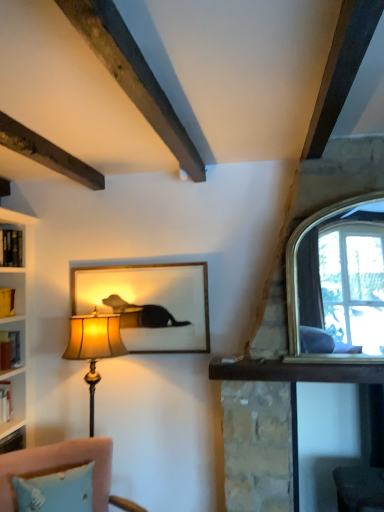
Question: Is velvet pink sofa at lower left not inside clear glass window at upper right?

Choices:
 (A) no
 (B) yes

Answer: (B)

Question: Is velvet pink sofa at lower left shorter than clear glass window at upper right?

Choices:
 (A) yes
 (B) no

Answer: (A)

Question: Is velvet pink sofa at lower left facing away from clear glass window at upper right?

Choices:
 (A) no
 (B) yes

Answer: (A)

Question: Is the surface of velvet pink sofa at lower left in direct contact with clear glass window at upper right?

Choices:
 (A) no
 (B) yes

Answer: (A)

Question: From the image's perspective, is velvet pink sofa at lower left below clear glass window at upper right?

Choices:
 (A) no
 (B) yes

Answer: (B)

Question: From a real-world perspective, is velvet pink sofa at lower left on clear glass window at upper right?

Choices:
 (A) no
 (B) yes

Answer: (A)

Question: From the image's perspective, would you say matte glass picture frame at center is positioned over matte gold lampshade at left?

Choices:
 (A) no
 (B) yes

Answer: (B)

Question: Does matte glass picture frame at center turn towards matte gold lampshade at left?

Choices:
 (A) yes
 (B) no

Answer: (A)

Question: Are matte glass picture frame at center and matte gold lampshade at left located far from each other?

Choices:
 (A) no
 (B) yes

Answer: (A)

Question: Can you confirm if matte glass picture frame at center is positioned to the right of matte gold lampshade at left?

Choices:
 (A) yes
 (B) no

Answer: (A)

Question: Can you confirm if matte glass picture frame at center is wider than matte gold lampshade at left?

Choices:
 (A) no
 (B) yes

Answer: (A)

Question: From the image's perspective, is matte glass picture frame at center beneath matte gold lampshade at left?

Choices:
 (A) yes
 (B) no

Answer: (B)

Question: Does matte gold lampshade at left have a greater height compared to matte glass picture frame at center?

Choices:
 (A) yes
 (B) no

Answer: (A)